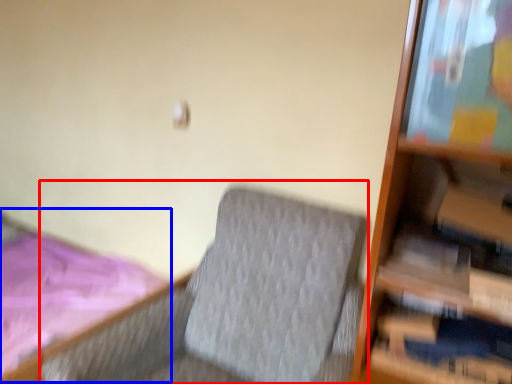
Question: Which point is further to the camera, rocking chair (highlighted by a red box) or bed (highlighted by a blue box)?

Choices:
 (A) rocking chair
 (B) bed

Answer: (B)